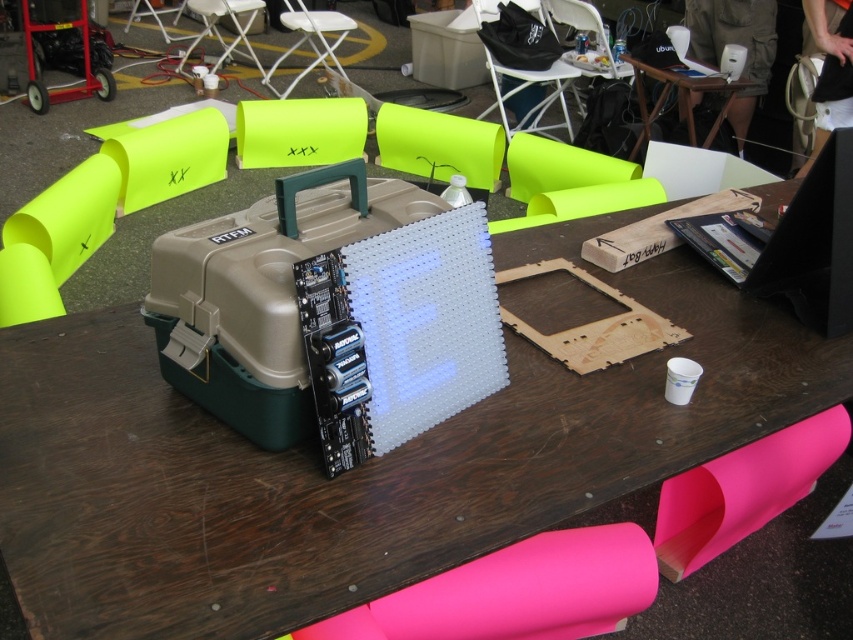
Question: Among these objects, which one is farthest from the camera?

Choices:
 (A) wooden table at upper center
 (B) brown wood table at center

Answer: (A)

Question: Which point is closer to the camera?

Choices:
 (A) (641, 81)
 (B) (155, 506)

Answer: (B)

Question: Does brown wood table at center appear on the left side of wooden table at upper center?

Choices:
 (A) no
 (B) yes

Answer: (B)

Question: Does brown wood table at center have a smaller size compared to wooden table at upper center?

Choices:
 (A) yes
 (B) no

Answer: (B)

Question: Does brown wood table at center lie behind wooden table at upper center?

Choices:
 (A) yes
 (B) no

Answer: (B)